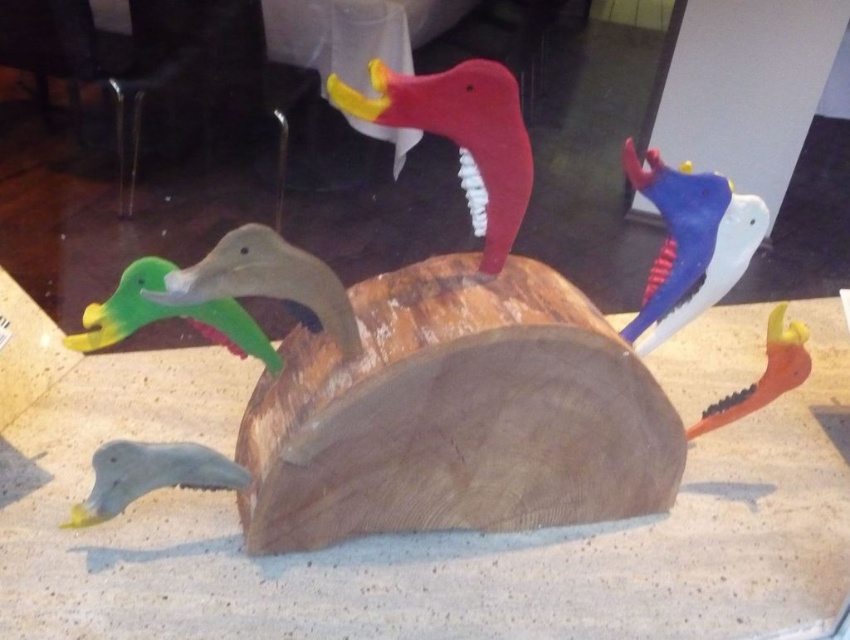
Question: Does rubber duck at center appear on the right side of green matte duck at left?

Choices:
 (A) no
 (B) yes

Answer: (B)

Question: Which object is farther from the camera taking this photo?

Choices:
 (A) green matte duck at left
 (B) matte gray duck at lower left
 (C) white matte bird at upper right

Answer: (C)

Question: Can you confirm if white matte bird at upper right is bigger than matte gray duck at lower left?

Choices:
 (A) no
 (B) yes

Answer: (B)

Question: Which object is farther from the camera taking this photo?

Choices:
 (A) matte gray duck at lower left
 (B) white matte bird at upper right
 (C) matte green plastic duck at center

Answer: (B)

Question: Which object appears farthest from the camera in this image?

Choices:
 (A) white matte bird at upper right
 (B) matte gray duck at lower left
 (C) matte green plastic duck at center

Answer: (A)

Question: Can you confirm if rubber duck at center is wider than matte green plastic duck at center?

Choices:
 (A) yes
 (B) no

Answer: (B)